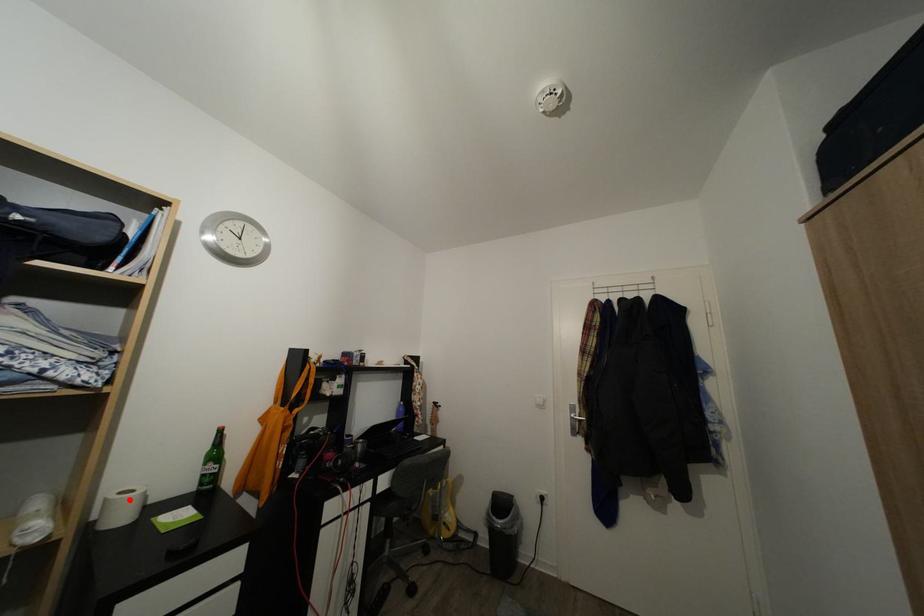
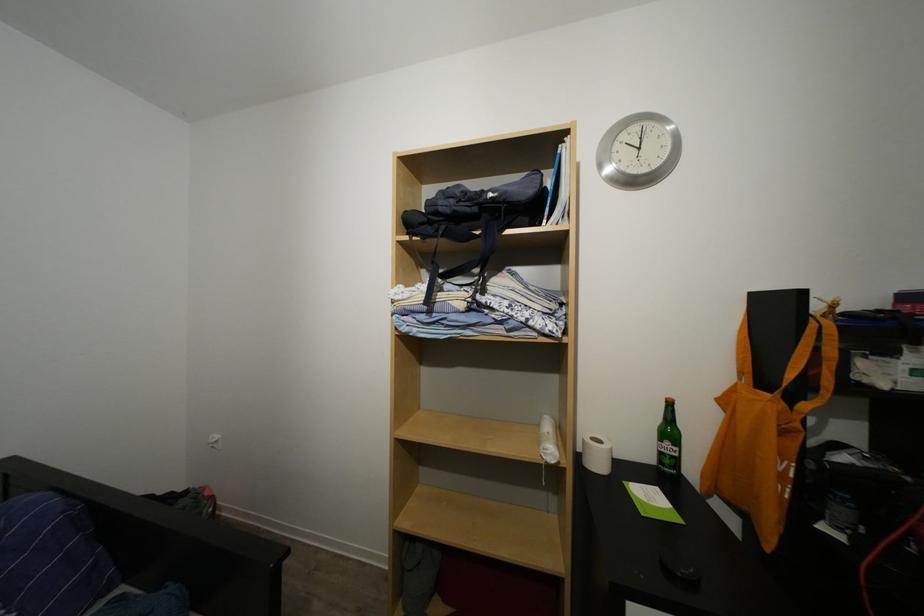
Where in the second image is the point corresponding to the highlighted location from the first image?

(601, 446)